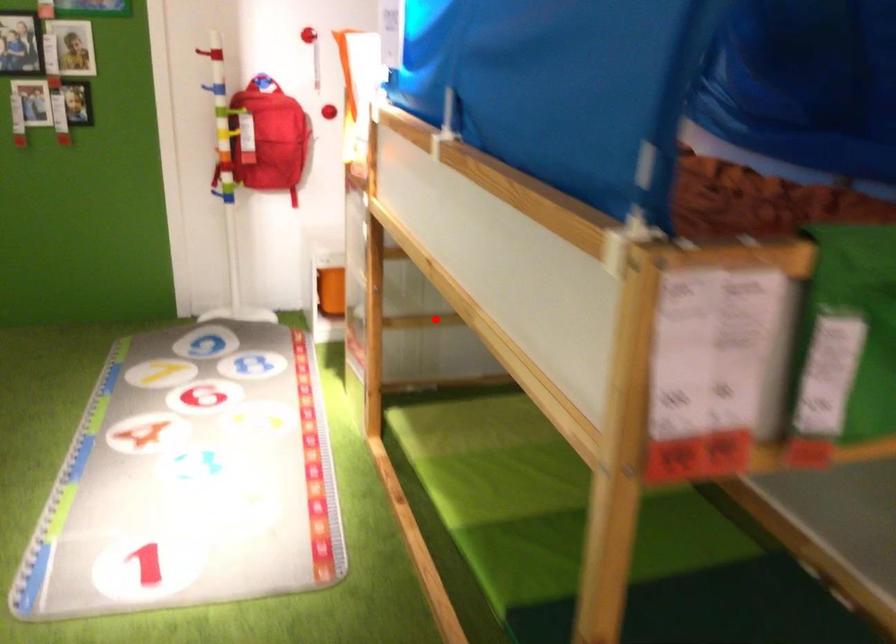
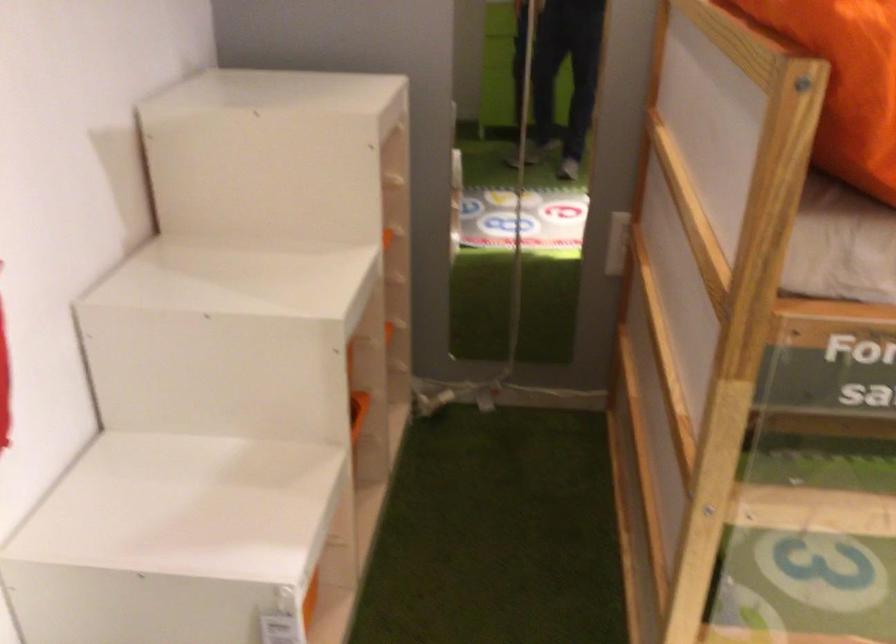
Locate, in the second image, the point that corresponds to the highlighted location in the first image.

(642, 469)